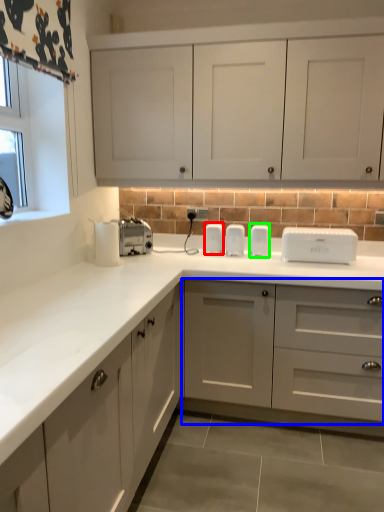
Question: Which object is positioned farthest from appliance (highlighted by a red box)? Select from cabinetry (highlighted by a blue box) and appliance (highlighted by a green box).

Choices:
 (A) cabinetry
 (B) appliance

Answer: (A)